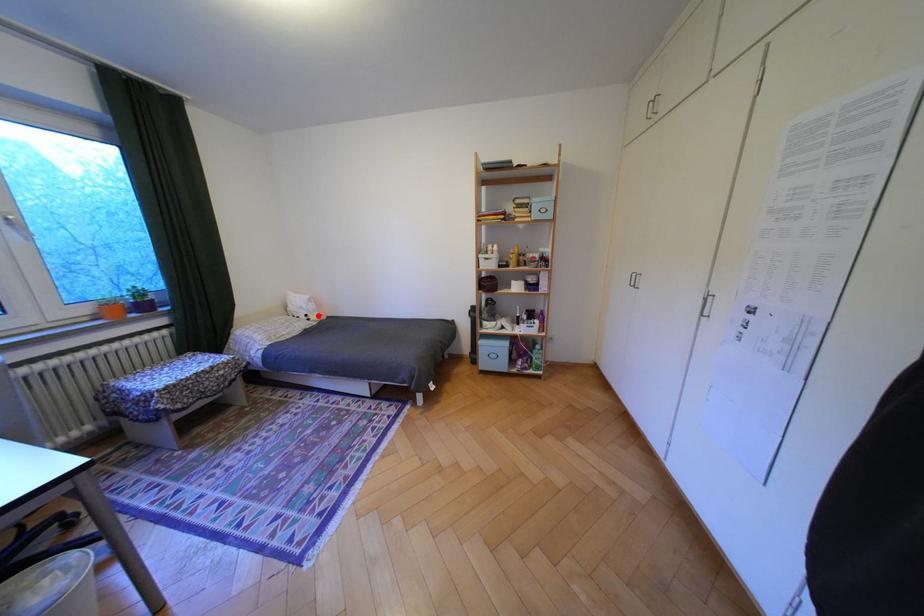
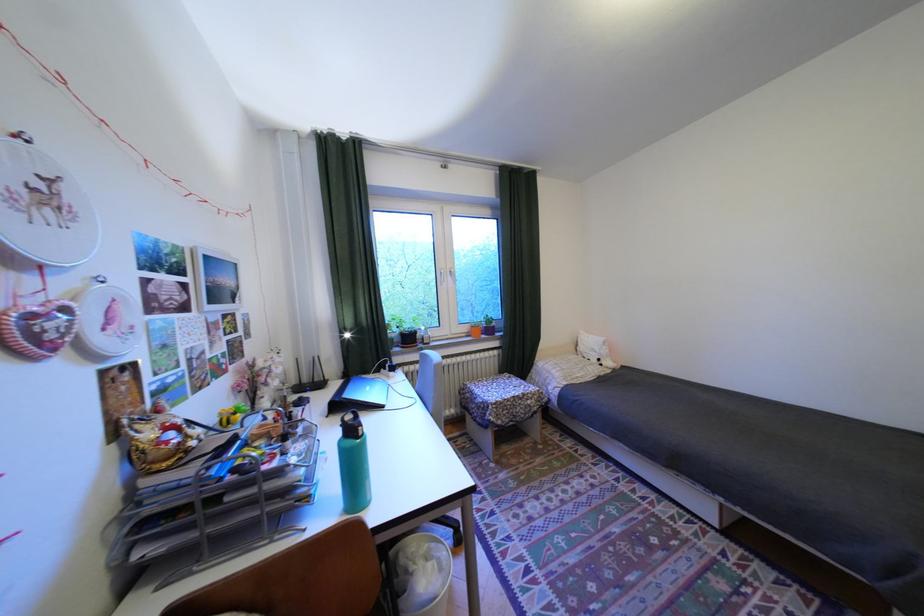
Find the pixel in the second image that matches the highlighted location in the first image.

(611, 360)